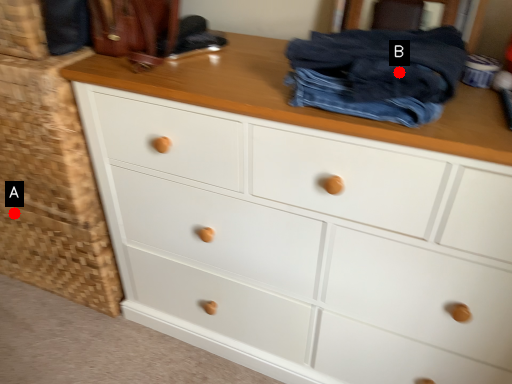
Question: Two points are circled on the image, labeled by A and B beside each circle. Which point is closer to the camera?

Choices:
 (A) A is closer
 (B) B is closer

Answer: (B)